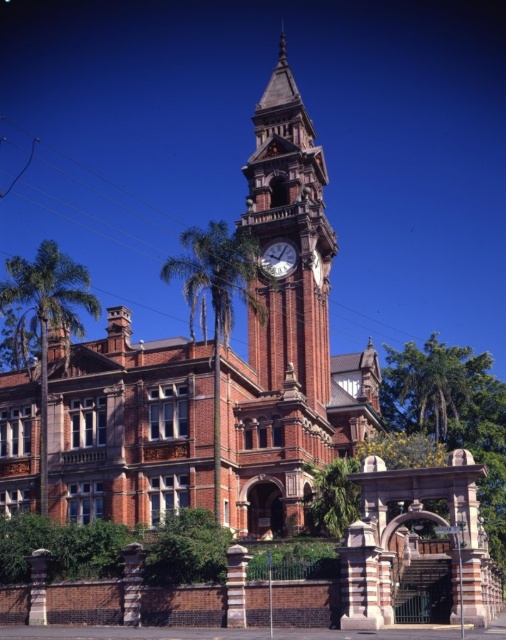
Question: Is red brick clock tower at center further to camera compared to green leafy palm tree at center?

Choices:
 (A) yes
 (B) no

Answer: (A)

Question: Can you confirm if green leafy palm tree at left is positioned below green leafy palm tree at center?

Choices:
 (A) yes
 (B) no

Answer: (A)

Question: Which of these objects is positioned closest to the red brick clock tower at center?

Choices:
 (A) green leafy palm tree at center
 (B) green leafy palm tree at left
 (C) white glossy clock at upper center

Answer: (C)

Question: Which of these objects is positioned farthest from the red brick clock tower at center?

Choices:
 (A) green leafy palm tree at left
 (B) green leafy palm tree at center
 (C) white glossy clock at upper center

Answer: (A)

Question: Which of the following is the farthest from the observer?

Choices:
 (A) green leafy palm tree at center
 (B) red brick clock tower at center
 (C) white glossy clock at upper center

Answer: (C)

Question: Can you confirm if red brick clock tower at center is positioned to the left of white glossy clock at upper center?

Choices:
 (A) no
 (B) yes

Answer: (A)